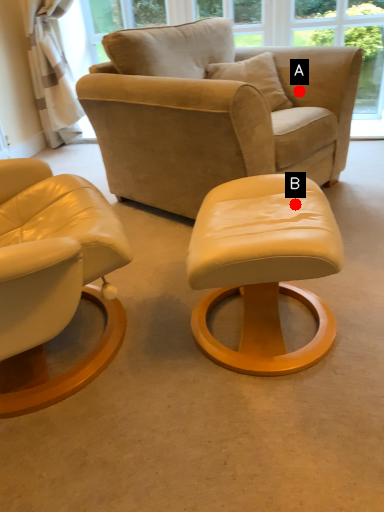
Question: Two points are circled on the image, labeled by A and B beside each circle. Which point is farther from the camera taking this photo?

Choices:
 (A) A is further
 (B) B is further

Answer: (A)